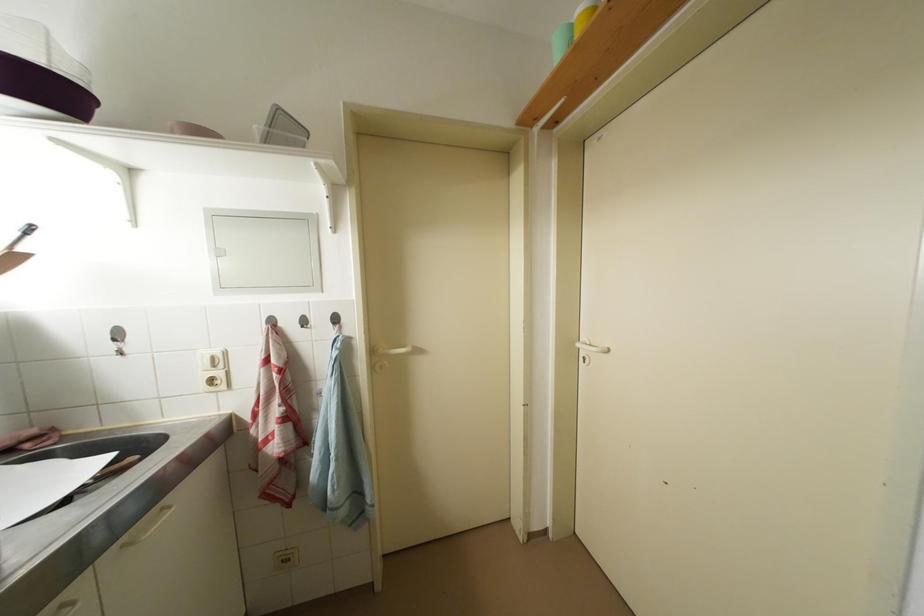
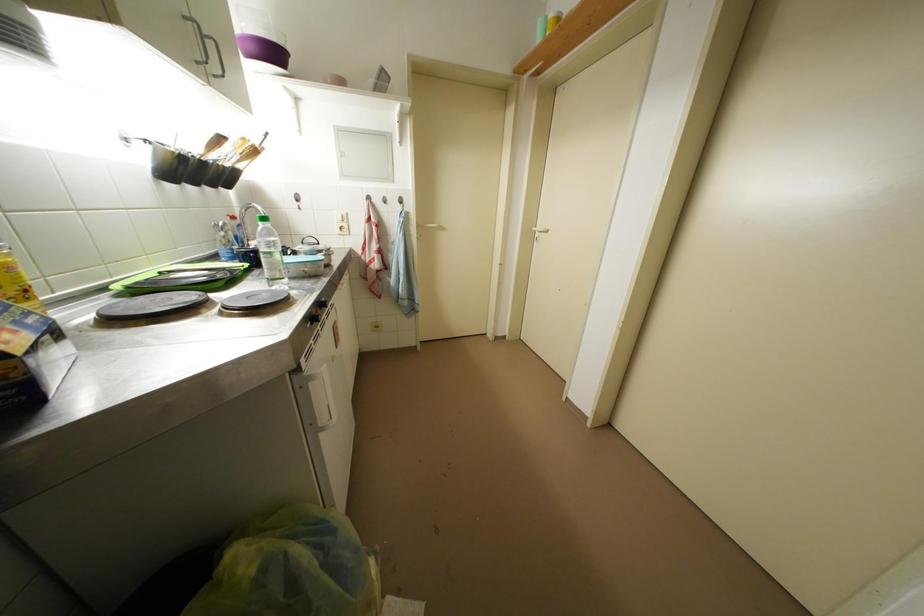
Question: What movement of the cameraman would produce the second image?

Choices:
 (A) Left
 (B) Right
 (C) Forward
 (D) Backward

Answer: (D)